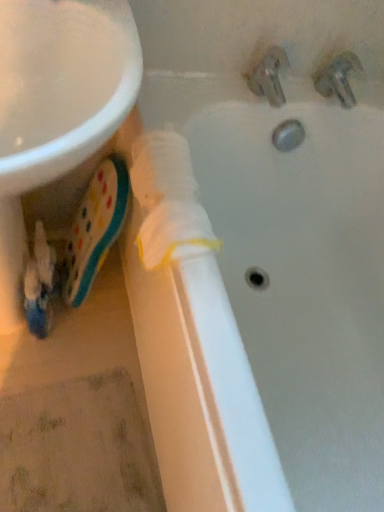
Question: Is metallic silver tap at upper right, marked as the 1th tap in a right-to-left arrangement, in front of or behind metallic chrome faucet at upper right, which is counted as the 1th tap, starting from the left, in the image?

Choices:
 (A) front
 (B) behind

Answer: (B)

Question: Considering the positions of metallic silver tap at upper right, marked as the 1th tap in a right-to-left arrangement, and metallic chrome faucet at upper right, which is counted as the 1th tap, starting from the left, in the image, is metallic silver tap at upper right, marked as the 1th tap in a right-to-left arrangement, wider or thinner than metallic chrome faucet at upper right, which is counted as the 1th tap, starting from the left,?

Choices:
 (A) wide
 (B) thin

Answer: (A)

Question: Which is nearer to the white matte pipe at center?

Choices:
 (A) metallic silver tap at upper right, the 2th tap when ordered from left to right
 (B) metallic chrome faucet at upper right, which is counted as the 1th tap, starting from the left
 (C) matte plastic toothpaste at lower left

Answer: (A)

Question: Which of these objects is positioned farthest from the white matte pipe at center?

Choices:
 (A) matte plastic toothpaste at lower left
 (B) metallic silver tap at upper right, the 2th tap when ordered from left to right
 (C) metallic chrome faucet at upper right, the second tap viewed from the right

Answer: (A)